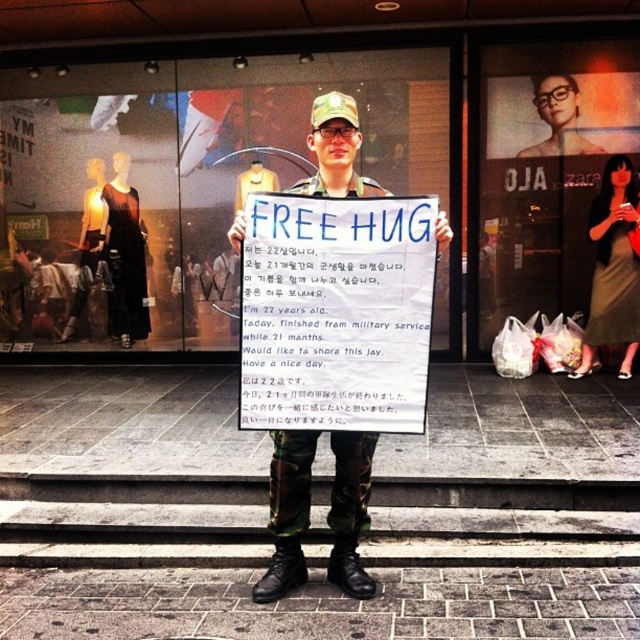
You are a photographer standing in front of the glass display at center and the blue paper sign at center. Which object is closer to you?

The glass display at center is closer to you because it is further to the viewer than the blue paper sign at center.

From the picture: You are a passerby who wants to read the message on the blue paper sign at center. Where should you stand relative to the glass display at center to see it clearly?

The blue paper sign at center is to the right of the glass display at center. To read the message on the blue paper sign at center, you should stand to the right side of the glass display at center.